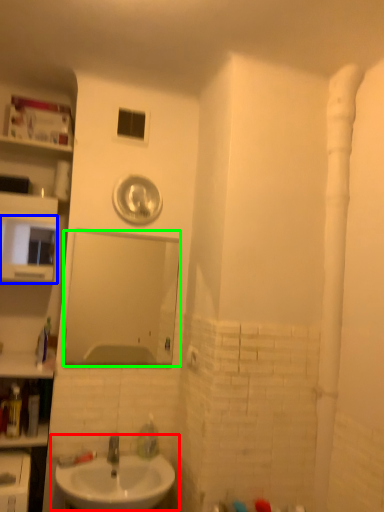
Question: Which object is positioned farthest from sink (highlighted by a red box)? Select from medicine cabinet (highlighted by a blue box) and mirror (highlighted by a green box).

Choices:
 (A) medicine cabinet
 (B) mirror

Answer: (A)